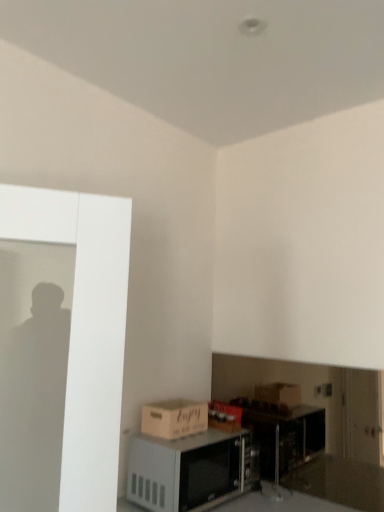
This screenshot has height=512, width=384. What do you see at coordinates (174, 418) in the screenshot?
I see `matte brown cardboard box at lower left` at bounding box center [174, 418].

You are a GUI agent. You are given a task and a screenshot of the screen. Output one action in this format:
    pyautogui.click(x=<x>, y=<y>)
    Task: Click on the matte brown cardboard box at lower left
    The width and height of the screenshot is (384, 512).
    Given the screenshot: What is the action you would take?
    pyautogui.click(x=174, y=418)

This screenshot has width=384, height=512. Find the location of `white matte microwave at lower center`. white matte microwave at lower center is located at coordinates (188, 470).

What do you see at coordinates (188, 470) in the screenshot? Image resolution: width=384 pixels, height=512 pixels. I see `white matte microwave at lower center` at bounding box center [188, 470].

Looking at this image, what is the approximate width of white matte microwave at lower center?

13.59 inches.

Find the location of a particular element. The image size is (384, 512). matte brown cardboard box at lower left is located at coordinates (174, 418).

Is white matte microwave at lower center to the left of matte brown cardboard box at lower left from the viewer's perspective?

No, white matte microwave at lower center is not to the left of matte brown cardboard box at lower left.

Which is behind, white matte microwave at lower center or matte brown cardboard box at lower left?

matte brown cardboard box at lower left is more distant.

Considering the points (140, 445) and (146, 412), which point is in front, point (140, 445) or point (146, 412)?

The point (140, 445) is in front.

From the image's perspective, which is below, white matte microwave at lower center or matte brown cardboard box at lower left?

white matte microwave at lower center, from the image's perspective.

From a real-world perspective, is white matte microwave at lower center physically above matte brown cardboard box at lower left?

Actually, white matte microwave at lower center is physically below matte brown cardboard box at lower left in the real world.

Considering the relative sizes of white matte microwave at lower center and matte brown cardboard box at lower left in the image provided, is white matte microwave at lower center thinner than matte brown cardboard box at lower left?

Incorrect, the width of white matte microwave at lower center is not less than that of matte brown cardboard box at lower left.

Considering the relative sizes of white matte microwave at lower center and matte brown cardboard box at lower left in the image provided, is white matte microwave at lower center shorter than matte brown cardboard box at lower left?

No.

Considering the sizes of objects white matte microwave at lower center and matte brown cardboard box at lower left in the image provided, who is smaller, white matte microwave at lower center or matte brown cardboard box at lower left?

matte brown cardboard box at lower left.

Is white matte microwave at lower center not within matte brown cardboard box at lower left?

That's correct, white matte microwave at lower center is outside of matte brown cardboard box at lower left.

Is white matte microwave at lower center placed right next to matte brown cardboard box at lower left?

white matte microwave at lower center is not next to matte brown cardboard box at lower left, and they're not touching.

Could you tell me if white matte microwave at lower center is turned towards matte brown cardboard box at lower left?

No.

How many degrees apart are the facing directions of white matte microwave at lower center and matte brown cardboard box at lower left?

0.000377 degrees separate the facing orientations of white matte microwave at lower center and matte brown cardboard box at lower left.

This screenshot has width=384, height=512. I want to click on microwave on the right of matte brown cardboard box at lower left, so click(x=188, y=470).

In the image, is matte brown cardboard box at lower left on the left side or the right side of white matte microwave at lower center?

Based on their positions, matte brown cardboard box at lower left is located to the left of white matte microwave at lower center.

Between matte brown cardboard box at lower left and white matte microwave at lower center, which one is positioned in front?

white matte microwave at lower center is closer to the camera.

Which is more distant, [171,406] or [169,484]?

The point [171,406] is behind.

From the image's perspective, between matte brown cardboard box at lower left and white matte microwave at lower center, who is located below?

white matte microwave at lower center is shown below in the image.

In the scene shown: From a real-world perspective, is matte brown cardboard box at lower left physically above white matte microwave at lower center?

Yes, from a real-world perspective, matte brown cardboard box at lower left is on top of white matte microwave at lower center.

Considering the relative sizes of matte brown cardboard box at lower left and white matte microwave at lower center in the image provided, is matte brown cardboard box at lower left thinner than white matte microwave at lower center?

Correct, the width of matte brown cardboard box at lower left is less than that of white matte microwave at lower center.

Considering the sizes of matte brown cardboard box at lower left and white matte microwave at lower center in the image, is matte brown cardboard box at lower left taller or shorter than white matte microwave at lower center?

In the image, matte brown cardboard box at lower left appears to be shorter than white matte microwave at lower center.

Does matte brown cardboard box at lower left have a smaller size compared to white matte microwave at lower center?

Correct, matte brown cardboard box at lower left occupies less space than white matte microwave at lower center.

Is matte brown cardboard box at lower left inside the boundaries of white matte microwave at lower center, or outside?

The correct answer is: outside.

Looking at this image, are matte brown cardboard box at lower left and white matte microwave at lower center beside each other?

matte brown cardboard box at lower left is not next to white matte microwave at lower center, and they're not touching.

Is matte brown cardboard box at lower left oriented towards white matte microwave at lower center?

No, matte brown cardboard box at lower left is not aimed at white matte microwave at lower center.

Can you tell me how much matte brown cardboard box at lower left and white matte microwave at lower center differ in facing direction?

matte brown cardboard box at lower left and white matte microwave at lower center are facing 0.000377 degrees away from each other.

You are a GUI agent. You are given a task and a screenshot of the screen. Output one action in this format:
    pyautogui.click(x=<x>, y=<y>)
    Task: Click on the microwave that is on the right side of matte brown cardboard box at lower left
    The image size is (384, 512).
    Given the screenshot: What is the action you would take?
    pyautogui.click(x=188, y=470)

Where is `microwave below the matte brown cardboard box at lower left (from the image's perspective)`? The height and width of the screenshot is (512, 384). microwave below the matte brown cardboard box at lower left (from the image's perspective) is located at coordinates (188, 470).

In order to click on microwave beneath the matte brown cardboard box at lower left (from a real-world perspective) in this screenshot , I will do `click(188, 470)`.